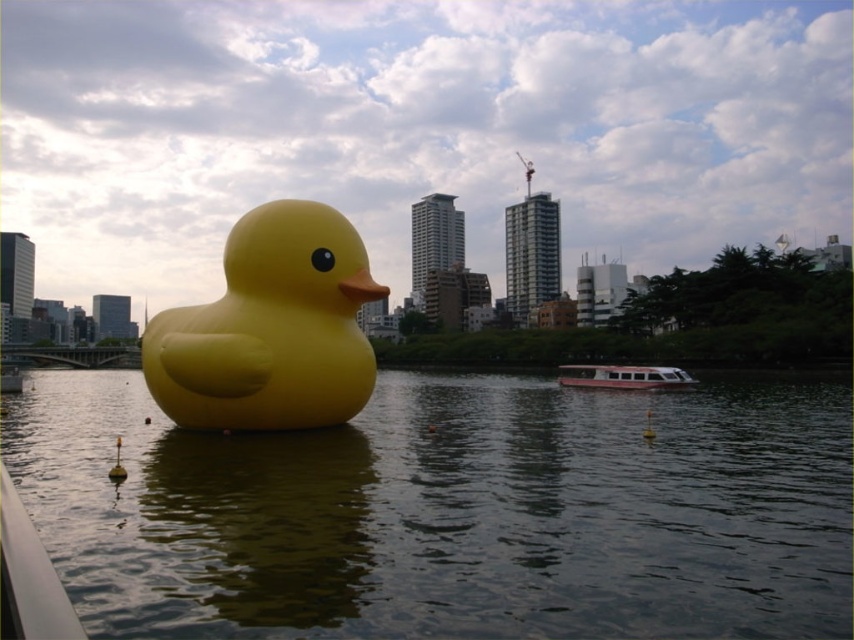
Is point (471, 493) more distant than point (648, 378)?

No.

This screenshot has height=640, width=854. What do you see at coordinates (449, 512) in the screenshot?
I see `smooth water at center` at bounding box center [449, 512].

Is point (812, 442) farther from camera compared to point (572, 368)?

That is False.

You are a GUI agent. You are given a task and a screenshot of the screen. Output one action in this format:
    pyautogui.click(x=<x>, y=<y>)
    Task: Click on the smooth water at center
    
    Given the screenshot: What is the action you would take?
    pyautogui.click(x=449, y=512)

The height and width of the screenshot is (640, 854). What do you see at coordinates (449, 512) in the screenshot?
I see `smooth water at center` at bounding box center [449, 512].

Which is more to the left, smooth water at center or yellow matte rubber duck at center?

smooth water at center is more to the left.

Is point (107, 547) positioned in front of point (184, 332)?

That is True.

The image size is (854, 640). In order to click on smooth water at center in this screenshot , I will do `click(449, 512)`.

Can you confirm if yellow matte rubber duck at center is taller than white glossy boat at center?

Correct, yellow matte rubber duck at center is much taller as white glossy boat at center.

Between yellow matte rubber duck at center and white glossy boat at center, which one is positioned lower?

white glossy boat at center is lower down.

Identify the location of yellow matte rubber duck at center. This screenshot has width=854, height=640. (270, 328).

Where is `yellow matte rubber duck at center`? This screenshot has width=854, height=640. yellow matte rubber duck at center is located at coordinates (270, 328).